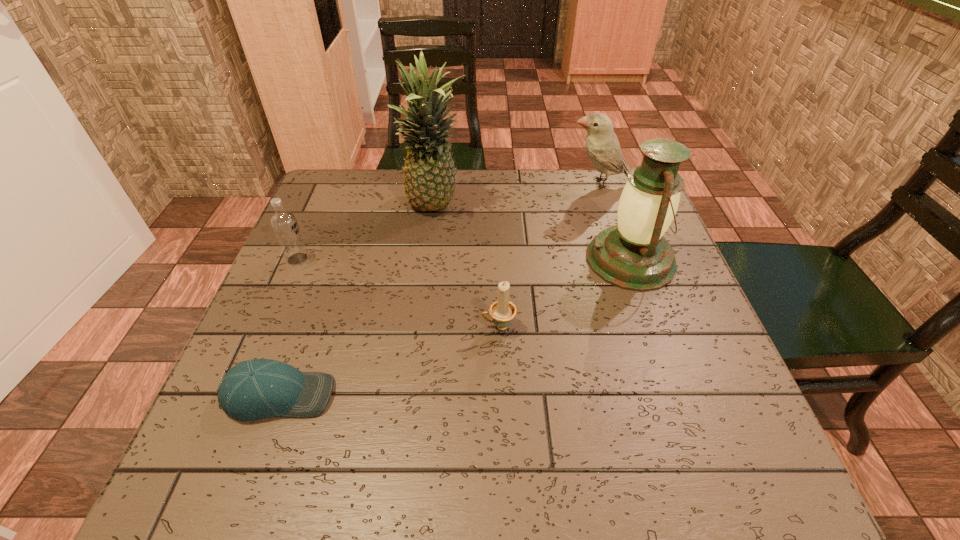
The width and height of the screenshot is (960, 540). I want to click on vacant space located 0.380m on the back of the nearest object, so click(x=336, y=237).

Find the location of `pineapple located at the far edge`. pineapple located at the far edge is located at coordinates (429, 181).

Image resolution: width=960 pixels, height=540 pixels. Identify the location of bird that is at the far edge. (602, 145).

Locate an element on the screen. vodka situated at the left edge is located at coordinates (284, 224).

At what (x,y) coordinates should I click in order to perform the action: click on baseball cap located at the left edge. Please return your answer as a coordinate pair (x, y). The image size is (960, 540). Looking at the image, I should click on (254, 389).

Where is `lantern positioned at the right edge`? The height and width of the screenshot is (540, 960). lantern positioned at the right edge is located at coordinates (633, 255).

Locate an element on the screen. This screenshot has height=540, width=960. bird that is at the right edge is located at coordinates (602, 145).

You are a GUI agent. You are given a task and a screenshot of the screen. Output one action in this format:
    pyautogui.click(x=<x>, y=<y>)
    Task: Click on the object present at the far right corner
    
    Given the screenshot: What is the action you would take?
    pyautogui.click(x=602, y=145)

Identify the location of vacant space at the far edge of the desktop. (395, 195).

You are a GUI agent. You are given a task and a screenshot of the screen. Output one action in this format:
    pyautogui.click(x=<x>, y=<y>)
    Task: Click on the free spot at the near edge of the desktop
    The image size is (960, 540).
    Given the screenshot: What is the action you would take?
    pyautogui.click(x=654, y=491)